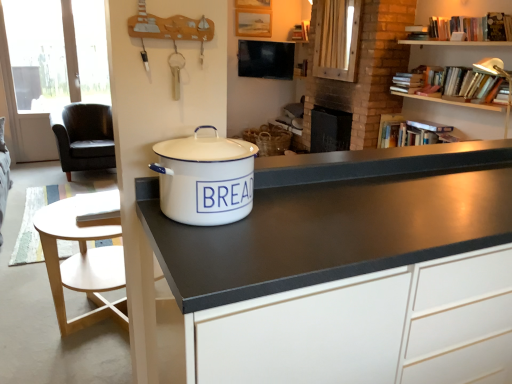
Locate an element on the screen. unoccupied region to the right of white enamel bread bin at center is located at coordinates (298, 221).